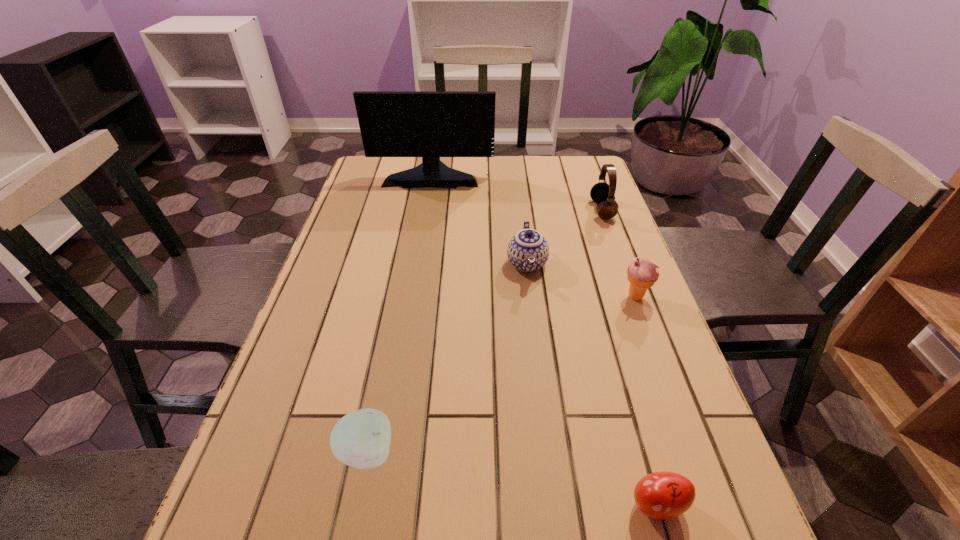
This screenshot has width=960, height=540. What are the coordinates of `vacant region located on the ear pads of the second farthest object` in the screenshot? It's located at (540, 210).

Where is `vacant space located 0.110m on the ear pads of the second farthest object`? vacant space located 0.110m on the ear pads of the second farthest object is located at coordinates (554, 210).

The image size is (960, 540). What are the coordinates of `free space located on the ear pads of the second farthest object` in the screenshot? It's located at (524, 210).

Where is `free space located 0.320m on the back of the icecream`? This screenshot has height=540, width=960. free space located 0.320m on the back of the icecream is located at coordinates (604, 213).

The width and height of the screenshot is (960, 540). Identify the location of vacant region located at the spout of the chinaware. (540, 364).

The image size is (960, 540). What are the coordinates of `free space located on the back of the left apple` in the screenshot? It's located at pyautogui.click(x=390, y=337).

What are the coordinates of `free space located on the left of the nearest object` in the screenshot? It's located at (438, 505).

Locate an element on the screen. This screenshot has height=540, width=960. object positioned at the far edge is located at coordinates (430, 124).

Identify the location of monitor positioned at the left edge. The width and height of the screenshot is (960, 540). (430, 124).

This screenshot has height=540, width=960. Find the location of `apple present at the left edge`. apple present at the left edge is located at coordinates (361, 439).